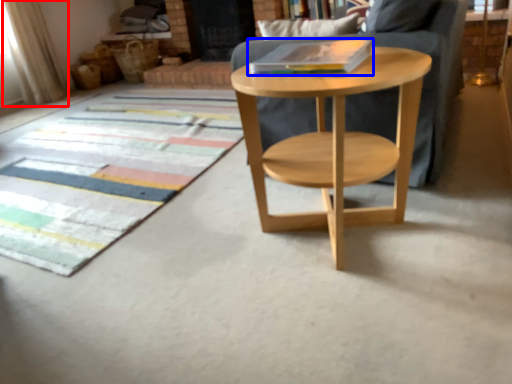
Question: Which of the following is the closest to the observer, curtain (highlighted by a red box) or book (highlighted by a blue box)?

Choices:
 (A) curtain
 (B) book

Answer: (B)